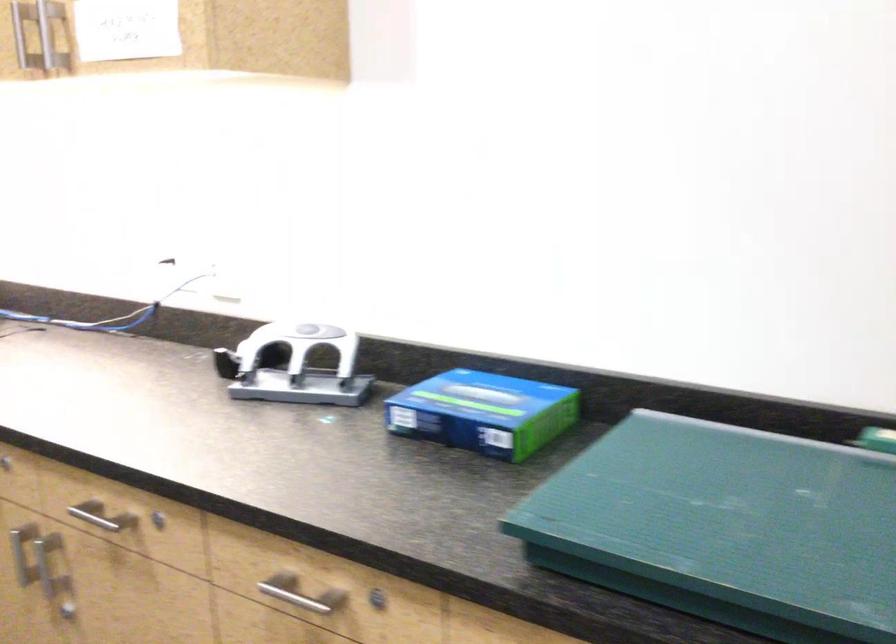
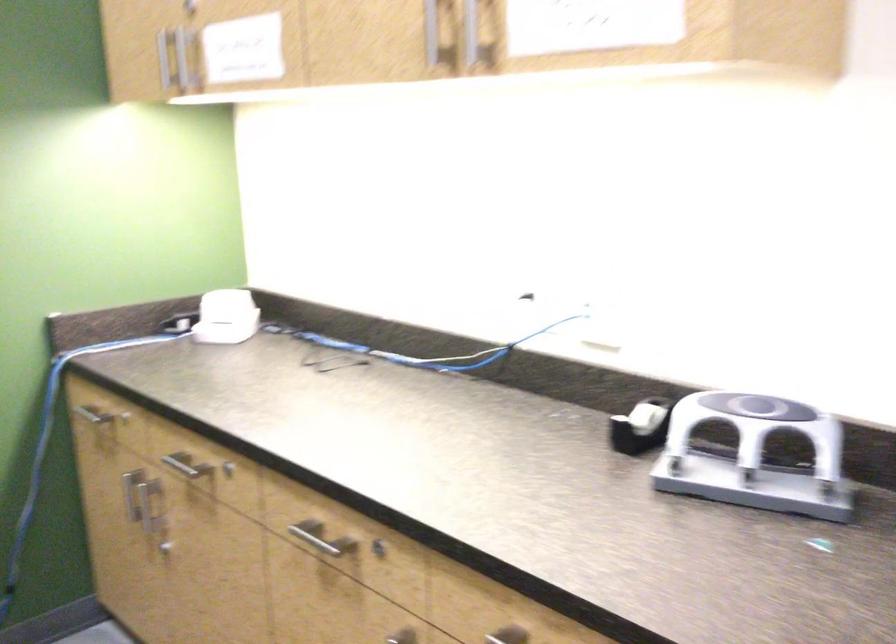
Question: How did the camera likely rotate?

Choices:
 (A) Left
 (B) Right
 (C) Up
 (D) Down

Answer: (A)